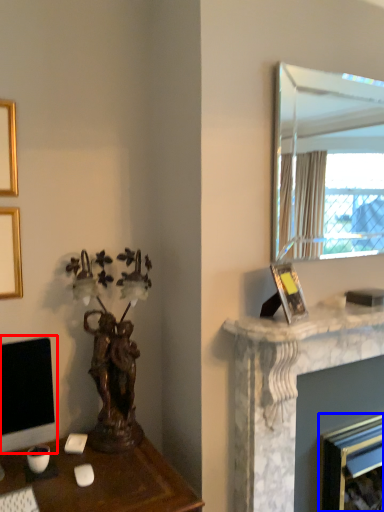
Question: Which point is further to the camera, computer monitor (highlighted by a red box) or fireplace (highlighted by a blue box)?

Choices:
 (A) computer monitor
 (B) fireplace

Answer: (B)